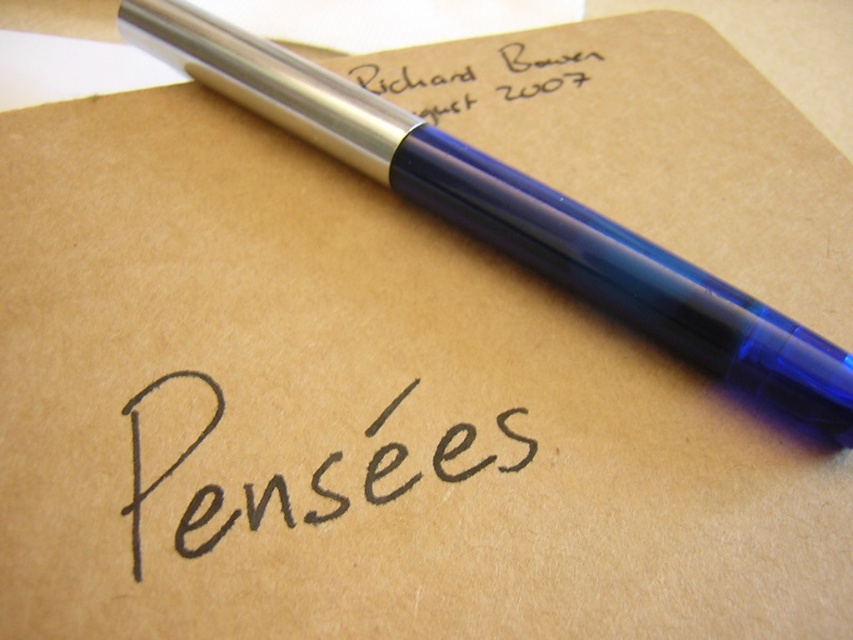
Question: Can you confirm if transparent blue pen at upper center is positioned to the right of black ink writing at center?

Choices:
 (A) no
 (B) yes

Answer: (B)

Question: Which is farther from the black ink writing at center?

Choices:
 (A) transparent blue pen at upper center
 (B) silver metallic pen at upper right

Answer: (B)

Question: Is black ink writing at center further to the viewer compared to silver metallic pen at upper right?

Choices:
 (A) yes
 (B) no

Answer: (B)

Question: Estimate the real-world distances between objects in this image. Which object is farther from the transparent blue pen at upper center?

Choices:
 (A) silver metallic pen at upper right
 (B) black ink writing at center

Answer: (B)

Question: Estimate the real-world distances between objects in this image. Which object is farther from the transparent blue pen at upper center?

Choices:
 (A) silver metallic pen at upper right
 (B) black ink writing at center

Answer: (B)

Question: Is the position of transparent blue pen at upper center more distant than that of silver metallic pen at upper right?

Choices:
 (A) yes
 (B) no

Answer: (B)